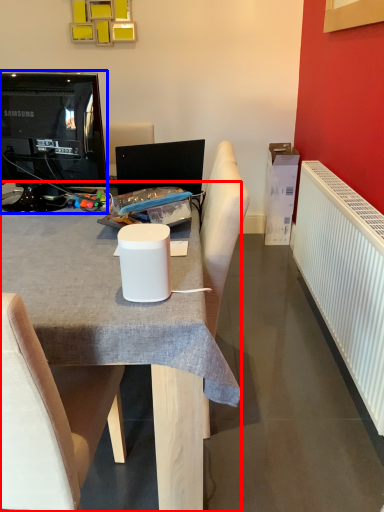
Question: Which object is further to the camera taking this photo, desk (highlighted by a red box) or television (highlighted by a blue box)?

Choices:
 (A) desk
 (B) television

Answer: (B)